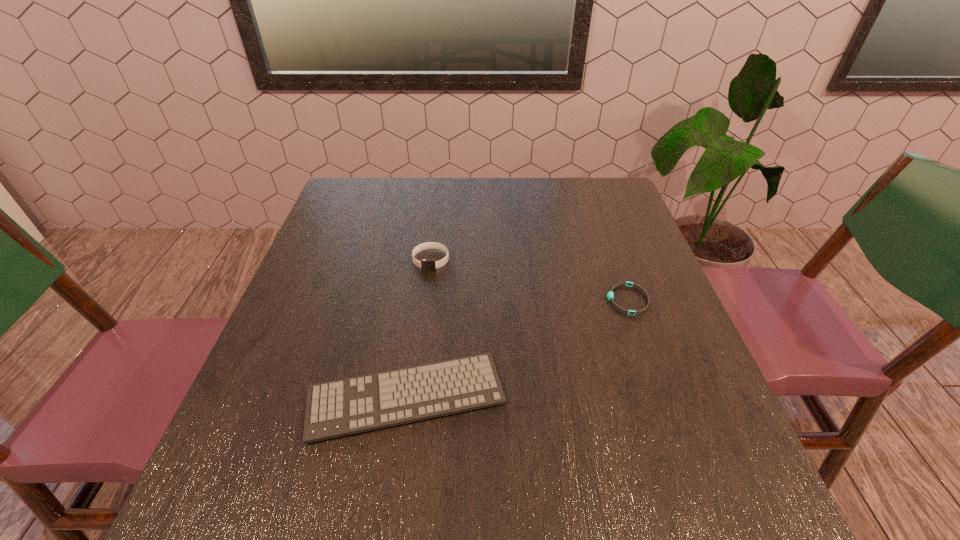
Identify the location of the farthest object. The width and height of the screenshot is (960, 540). (426, 264).

Where is `the left wristband`? the left wristband is located at coordinates (426, 264).

You are a GUI agent. You are given a task and a screenshot of the screen. Output one action in this format:
    pyautogui.click(x=<x>, y=<y>)
    Task: Click on the nearest object
    Image resolution: width=960 pixels, height=540 pixels.
    Given the screenshot: What is the action you would take?
    pyautogui.click(x=343, y=407)

Locate an element on the screen. This screenshot has width=960, height=540. computer keyboard is located at coordinates (343, 407).

In order to click on the nearer wristband in this screenshot , I will do `click(610, 296)`.

The width and height of the screenshot is (960, 540). I want to click on the right wristband, so click(610, 296).

The height and width of the screenshot is (540, 960). What are the coordinates of `vacant space located on the outer surface of the taller wristband` in the screenshot? It's located at (419, 352).

The height and width of the screenshot is (540, 960). In order to click on vacant space located on the right of the computer keyboard in this screenshot , I will do `click(532, 396)`.

Locate an element on the screen. This screenshot has width=960, height=540. free space located 0.070m on the buckle of the second farthest object is located at coordinates (577, 300).

You are a GUI agent. You are given a task and a screenshot of the screen. Output one action in this format:
    pyautogui.click(x=<x>, y=<y>)
    Task: Click on the vacant position located on the buckle of the second farthest object
    
    Given the screenshot: What is the action you would take?
    pyautogui.click(x=464, y=300)